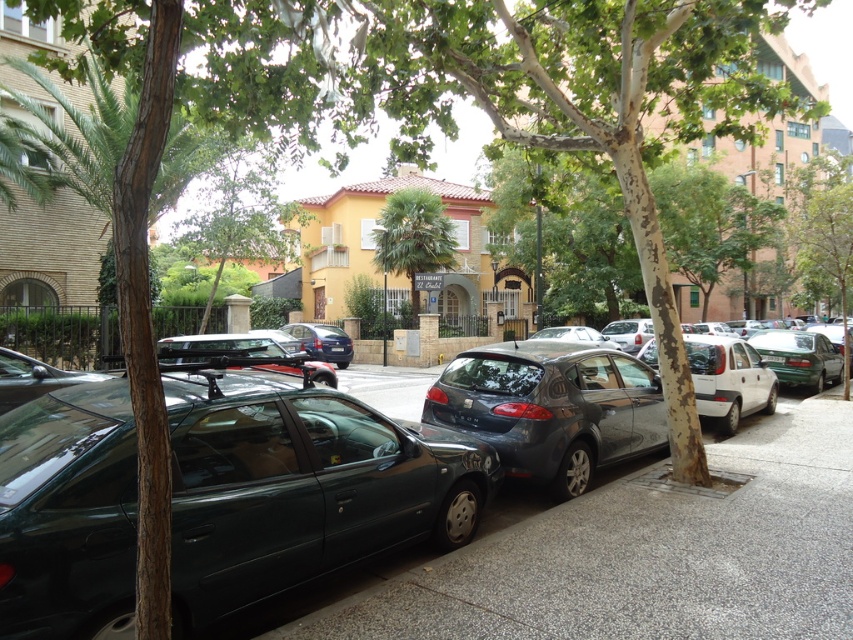
Between shiny black sedan at center and metallic gray hatchback at center, which one is positioned higher?

metallic gray hatchback at center is higher up.

Who is shorter, shiny black sedan at center or metallic gray hatchback at center?

shiny black sedan at center is shorter.

This screenshot has height=640, width=853. Find the location of `shiny black sedan at center`. shiny black sedan at center is located at coordinates pos(302,488).

Which is more to the right, shiny black sedan at center or shiny blue sedan at center?

From the viewer's perspective, shiny black sedan at center appears more on the right side.

Which of these two, shiny black sedan at center or shiny blue sedan at center, stands taller?

shiny black sedan at center

This screenshot has height=640, width=853. I want to click on shiny black sedan at center, so click(302, 488).

Does green leafy tree at upper center appear over green leafy palm tree at center?

Actually, green leafy tree at upper center is below green leafy palm tree at center.

Does green leafy tree at upper center appear under green leafy palm tree at center?

Yes, green leafy tree at upper center is below green leafy palm tree at center.

Identify the location of green leafy tree at upper center. click(x=239, y=216).

Identify the location of green leafy tree at upper center. (239, 216).